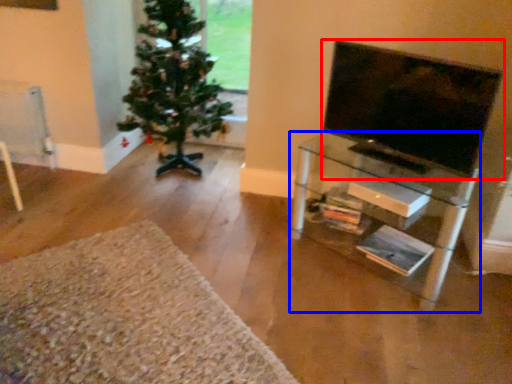
Question: Which object is further to the camera taking this photo, television (highlighted by a red box) or shelf (highlighted by a blue box)?

Choices:
 (A) television
 (B) shelf

Answer: (B)